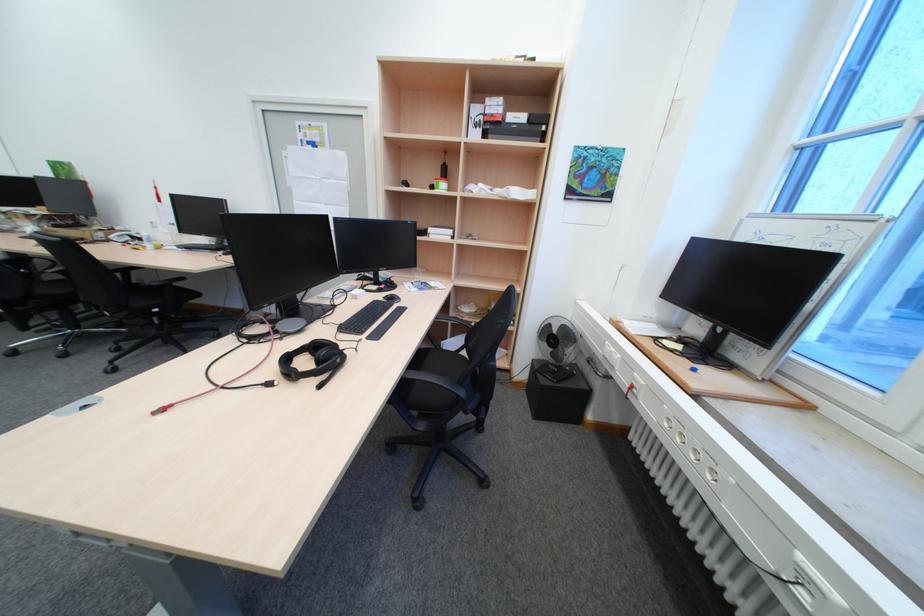
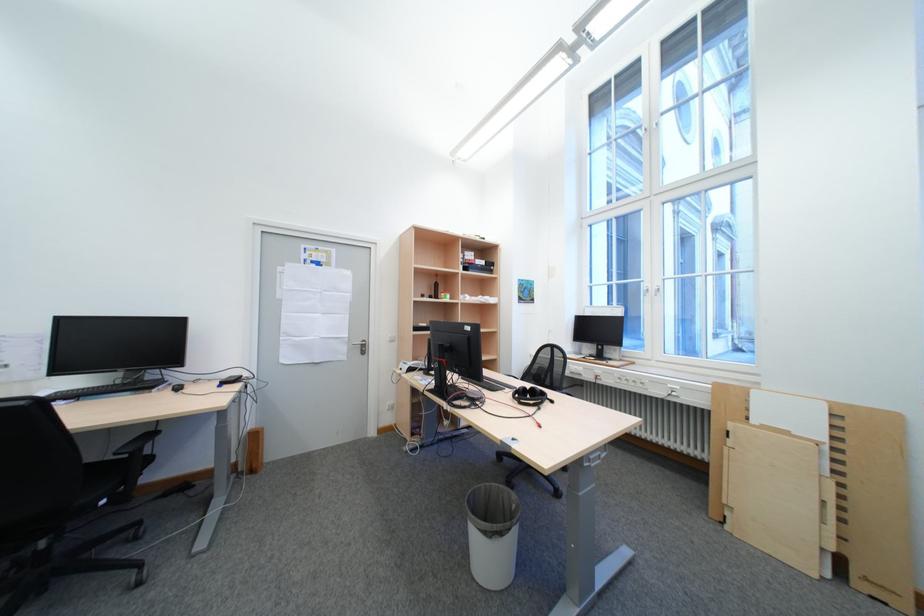
Where in the second image is the point corresponding to the point at 496,136 from the first image?

(477, 270)